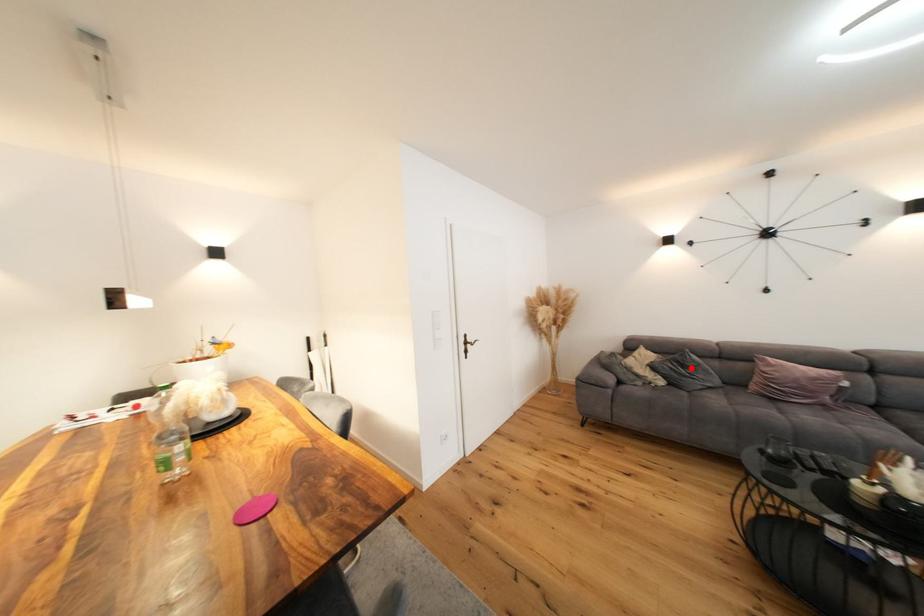
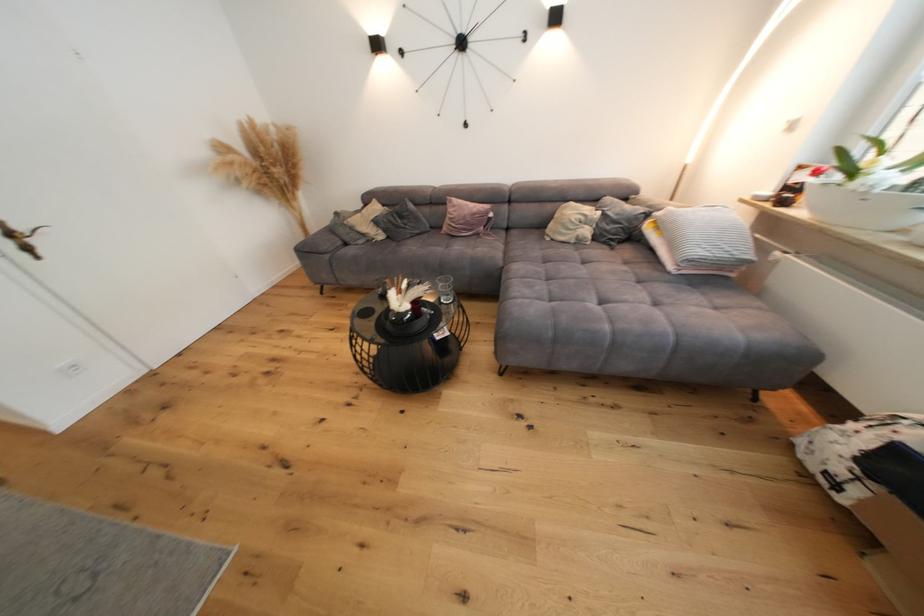
Question: I am providing you with two images of the same scene from different viewpoints. Image1 has a red point marked. In image2, the corresponding 3D location appears at what relative position? Reply with the corresponding letter.

Choices:
 (A) Closer
 (B) Farther

Answer: (A)